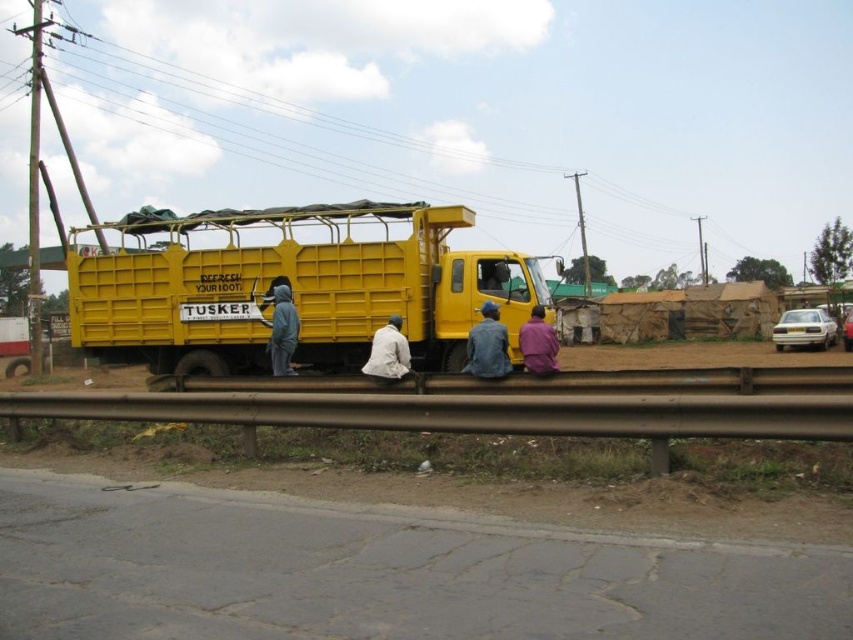
You are a photographer trying to capture a candid shot of the people on the truck. You want to ensure both the white matte jacket at center and the purple fabric shirt at lower center are visible in the frame. Based on their positions, which one should you focus on first to include both in the shot?

You should focus on the white matte jacket at center first because it is to the left of the purple fabric shirt at lower center, so by centering your shot on the leftmost object, you can ensure both are included.

You are a photographer trying to capture both the denim jacket at center and the purple fabric shirt at lower center in a single frame. Given their sizes, which one should you focus on to ensure both are clearly visible in your photo?

The denim jacket at center is larger in size than the purple fabric shirt at lower center, so focusing on the denim jacket at center will help ensure both are clearly visible in the photo.

You are a photographer taking a picture of the scene. You want to ensure both the white matte jacket at center and the gray hoodie at left are visible in the frame. Based on their positions, which one should you focus on first to capture both in the shot?

The white matte jacket at center is below the gray hoodie at left, so you should focus on the gray hoodie at left first to ensure both are in the frame.